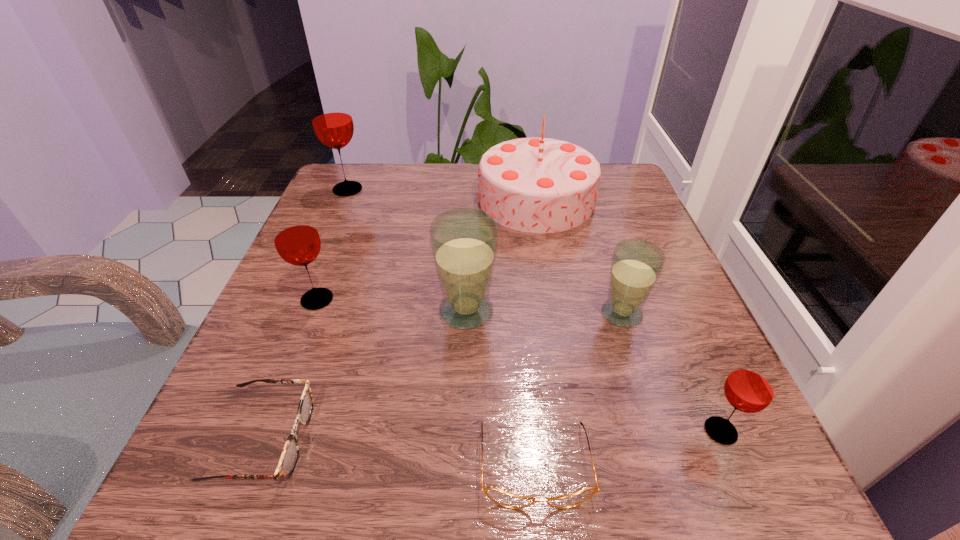
Find the location of a particular element. vacant space that's between the second smallest red glass and the biggest red glass is located at coordinates (332, 245).

You are a GUI agent. You are given a task and a screenshot of the screen. Output one action in this format:
    pyautogui.click(x=<x>, y=<y>)
    Task: Click on the vacant area that lies between the gold spectacles and the farthest red glass
    This screenshot has height=540, width=960.
    Given the screenshot: What is the action you would take?
    pos(442,327)

Identify the location of vacant area that lies between the rightmost red glass and the third glass from left to right. Image resolution: width=960 pixels, height=540 pixels. (593, 371).

Identify which object is located as the nearest to the rightmost glass. Please provide its 2D coordinates. Your answer should be formatted as a tuple, i.e. [(x, y)], where the tuple contains the x and y coordinates of a point satisfying the conditions above.

[(636, 264)]

Where is `object that is the seventh closest to the farthest red glass`? This screenshot has height=540, width=960. object that is the seventh closest to the farthest red glass is located at coordinates (751, 386).

Identify the location of glass that is the second nearest to the third glass from left to right. (297, 241).

Locate which glass ranks second in proximity to the second farthest red glass. Please provide its 2D coordinates. Your answer should be formatted as a tuple, i.e. [(x, y)], where the tuple contains the x and y coordinates of a point satisfying the conditions above.

[(331, 117)]

Find the location of a particular element. red glass that is the second closest to the left spectacles is located at coordinates (331, 117).

Find the location of a particular element. This screenshot has height=540, width=960. red glass that is the second closest to the smaller blue glass is located at coordinates (297, 241).